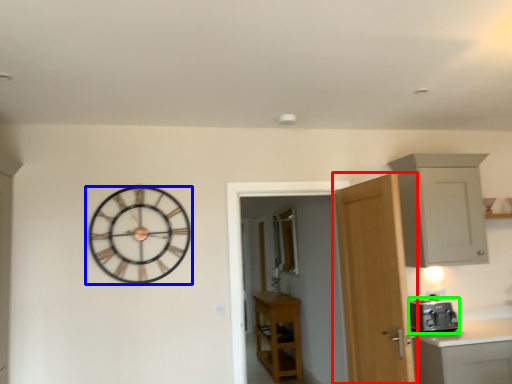
Question: Which object is the farthest from door (highlighted by a red box)? Choose among these: wall clock (highlighted by a blue box) or appliance (highlighted by a green box).

Choices:
 (A) wall clock
 (B) appliance

Answer: (A)